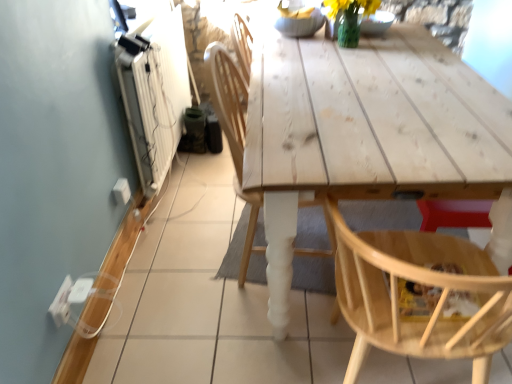
The height and width of the screenshot is (384, 512). Find the location of `natural wood chair at lower right, placed as the 1th chair when sorted from right to left`. natural wood chair at lower right, placed as the 1th chair when sorted from right to left is located at coordinates (418, 282).

What is the approximate width of white plastic electric outlet at lower left, which is counted as the 1th electric outlet, starting from the left?

0.41 inches.

You are a GUI agent. You are given a task and a screenshot of the screen. Output one action in this format:
    pyautogui.click(x=<x>, y=<y>)
    Task: Click on the wooden chair at center, acting as the 1th chair starting from the left
    This screenshot has width=512, height=384.
    Given the screenshot: What is the action you would take?
    pyautogui.click(x=233, y=133)

Locate an element on the screen. Image resolution: width=512 pixels, height=384 pixels. white plastic electric outlet at lower left, arranged as the 2th electric outlet when viewed from the front is located at coordinates (121, 191).

From a real-world perspective, is wooden chair at center, the 2th chair when ordered from right to left, located beneath white plastic electric outlet at lower left, the 2th electric outlet viewed from the right?

No, from a real-world perspective, wooden chair at center, the 2th chair when ordered from right to left, is not beneath white plastic electric outlet at lower left, the 2th electric outlet viewed from the right.

Could you tell me if wooden chair at center, acting as the 1th chair starting from the left, is turned towards white plastic electric outlet at lower left, the second electric outlet positioned from the back?

No, wooden chair at center, acting as the 1th chair starting from the left, is not turned towards white plastic electric outlet at lower left, the second electric outlet positioned from the back.

Can you confirm if wooden chair at center, the 2th chair when ordered from right to left, is positioned to the left of white plastic electric outlet at lower left, the second electric outlet positioned from the back?

Incorrect, wooden chair at center, the 2th chair when ordered from right to left, is not on the left side of white plastic electric outlet at lower left, the second electric outlet positioned from the back.

From the image's perspective, would you say wooden chair at center, acting as the 1th chair starting from the left, is shown under white plastic electric outlet at lower left, the second electric outlet positioned from the back?

No, from the image's perspective, wooden chair at center, acting as the 1th chair starting from the left, is not below white plastic electric outlet at lower left, the second electric outlet positioned from the back.

Is wooden chair at center, the 2th chair when ordered from right to left, inside or outside of white plastic electric outlet at lower left, the first electric outlet when ordered from top to bottom?

wooden chair at center, the 2th chair when ordered from right to left, exists outside the volume of white plastic electric outlet at lower left, the first electric outlet when ordered from top to bottom.

From the image's perspective, is wooden chair at center, acting as the 1th chair starting from the left, positioned above or below white plastic electric outlet at lower left, which is the second electric outlet in left-to-right order?

From the image's perspective, wooden chair at center, acting as the 1th chair starting from the left, appears above white plastic electric outlet at lower left, which is the second electric outlet in left-to-right order.

From the white plastic electric outlet at lower left, placed as the second electric outlet when sorted from bottom to top, count 1st chairs forward and point to it. Please provide its 2D coordinates.

[(233, 133)]

Can you confirm if white plastic electric outlet at lower left, acting as the 2th electric outlet starting from the top, is positioned to the right of white plastic electric outlet at lower left, the first electric outlet when ordered from top to bottom?

In fact, white plastic electric outlet at lower left, acting as the 2th electric outlet starting from the top, is to the left of white plastic electric outlet at lower left, the first electric outlet when ordered from top to bottom.

Does point (65, 323) appear closer or farther from the camera than point (117, 193)?

Point (65, 323) is positioned closer to the camera compared to point (117, 193).

From a real-world perspective, is white plastic electric outlet at lower left, placed as the first electric outlet when sorted from bottom to top, above or below white plastic electric outlet at lower left, acting as the 1th electric outlet starting from the back?

white plastic electric outlet at lower left, placed as the first electric outlet when sorted from bottom to top, is situated higher than white plastic electric outlet at lower left, acting as the 1th electric outlet starting from the back, in the real world.

Which point is more distant from viewer, (398, 314) or (63, 301)?

The point (63, 301) is behind.

Can you confirm if natural wood chair at lower right, the second chair positioned from the left, is wider than white plastic electric outlet at lower left, the 2th electric outlet viewed from the right?

Indeed, natural wood chair at lower right, the second chair positioned from the left, has a greater width compared to white plastic electric outlet at lower left, the 2th electric outlet viewed from the right.

Could you measure the distance between natural wood chair at lower right, placed as the 1th chair when sorted from right to left, and white plastic electric outlet at lower left, which is counted as the 1th electric outlet, starting from the left?

natural wood chair at lower right, placed as the 1th chair when sorted from right to left, and white plastic electric outlet at lower left, which is counted as the 1th electric outlet, starting from the left, are 3.50 feet apart.

Choose the correct answer: Is white plastic electric outlet at lower left, acting as the 2th electric outlet starting from the top, inside wooden chair at center, the 2th chair when ordered from right to left, or outside it?

white plastic electric outlet at lower left, acting as the 2th electric outlet starting from the top, is outside wooden chair at center, the 2th chair when ordered from right to left.

Is white plastic electric outlet at lower left, placed as the first electric outlet when sorted from bottom to top, positioned behind wooden chair at center, the 2th chair when ordered from right to left?

Yes, white plastic electric outlet at lower left, placed as the first electric outlet when sorted from bottom to top, is further from the viewer.

Locate an element on the screen. This screenshot has width=512, height=384. chair that is the 2nd object located above the white plastic electric outlet at lower left, the second electric outlet positioned from the back (from the image's perspective) is located at coordinates (233, 133).

From a real-world perspective, which object rests below the other?

white plastic electric outlet at lower left, the 2th electric outlet viewed from the right, is physically lower.

Is white plastic electric outlet at lower left, which is the second electric outlet in left-to-right order, shorter than wooden chair at center, the 2th chair when ordered from right to left?

Yes.

How much distance is there between white plastic electric outlet at lower left, which is the second electric outlet in left-to-right order, and wooden chair at center, acting as the 1th chair starting from the left?

white plastic electric outlet at lower left, which is the second electric outlet in left-to-right order, is 29.37 inches away from wooden chair at center, acting as the 1th chair starting from the left.

Which is closer to the camera, (122,190) or (237,185)?

The point (122,190) is in front.

In the scene shown: From the image's perspective, would you say white plastic electric outlet at lower left, acting as the 1th electric outlet starting from the back, is positioned over wooden chair at center, the 2th chair when ordered from right to left?

No, from the image's perspective, white plastic electric outlet at lower left, acting as the 1th electric outlet starting from the back, is not on top of wooden chair at center, the 2th chair when ordered from right to left.

Is white plastic electric outlet at lower left, which is the second electric outlet in left-to-right order, oriented away from white plastic electric outlet at lower left, the second electric outlet positioned from the back?

white plastic electric outlet at lower left, which is the second electric outlet in left-to-right order, does not have its back to white plastic electric outlet at lower left, the second electric outlet positioned from the back.

Is white plastic electric outlet at lower left, the first electric outlet when ordered from top to bottom, outside of white plastic electric outlet at lower left, acting as the 2th electric outlet starting from the top?

Yes.

Is white plastic electric outlet at lower left, the first electric outlet when ordered from top to bottom, far away from white plastic electric outlet at lower left, which is counted as the 1th electric outlet, starting from the left?

white plastic electric outlet at lower left, the first electric outlet when ordered from top to bottom, is near white plastic electric outlet at lower left, which is counted as the 1th electric outlet, starting from the left, not far away.

Is white plastic electric outlet at lower left, arranged as the first electric outlet when viewed from the right, positioned before white plastic electric outlet at lower left, which is counted as the 1th electric outlet, starting from the left?

No.

In order to click on electric outlet that is the 1st one below the wooden chair at center, the 2th chair when ordered from right to left (from a real-world perspective) in this screenshot , I will do `click(61, 303)`.

Find the location of a particular element. The height and width of the screenshot is (384, 512). the 1st chair to the right when counting from the white plastic electric outlet at lower left, the first electric outlet when ordered from top to bottom is located at coordinates (233, 133).

Looking at the image, which one is located further to white plastic electric outlet at lower left, arranged as the 2th electric outlet when viewed from the front, white plastic electric outlet at lower left, placed as the first electric outlet when sorted from bottom to top, or wooden chair at center, acting as the 1th chair starting from the left?

The object further to white plastic electric outlet at lower left, arranged as the 2th electric outlet when viewed from the front, is wooden chair at center, acting as the 1th chair starting from the left.

From the image, which object appears to be farther from wooden chair at center, acting as the 1th chair starting from the left, natural wood chair at lower right, placed as the 1th chair when sorted from right to left, or white plastic electric outlet at lower left, which is the second electric outlet in left-to-right order?

Based on the image, white plastic electric outlet at lower left, which is the second electric outlet in left-to-right order, appears to be further to wooden chair at center, acting as the 1th chair starting from the left.

Considering their positions, is wooden chair at center, the 2th chair when ordered from right to left, positioned closer to white plastic electric outlet at lower left, acting as the 1th electric outlet starting from the back, than white plastic electric outlet at lower left, the 2th electric outlet viewed from the right?

white plastic electric outlet at lower left, the 2th electric outlet viewed from the right, is closer to white plastic electric outlet at lower left, acting as the 1th electric outlet starting from the back.

From the image, which object appears to be nearer to natural wood chair at lower right, placed as the 1th chair when sorted from right to left, wooden chair at center, acting as the 1th chair starting from the left, or white plastic electric outlet at lower left, which is counted as the 1th electric outlet, starting from the left?

Based on the image, wooden chair at center, acting as the 1th chair starting from the left, appears to be nearer to natural wood chair at lower right, placed as the 1th chair when sorted from right to left.

Considering their positions, is natural wood chair at lower right, the second chair positioned from the left, positioned further to white plastic electric outlet at lower left, which is the second electric outlet in left-to-right order, than wooden chair at center, the 2th chair when ordered from right to left?

natural wood chair at lower right, the second chair positioned from the left.

Which object lies further to the anchor point natural wood chair at lower right, placed as the 1th chair when sorted from right to left, white plastic electric outlet at lower left, which is counted as the 1th electric outlet, starting from the left, or wooden chair at center, acting as the 1th chair starting from the left?

Based on the image, white plastic electric outlet at lower left, which is counted as the 1th electric outlet, starting from the left, appears to be further to natural wood chair at lower right, placed as the 1th chair when sorted from right to left.

Estimate the real-world distances between objects in this image. Which object is closer to wooden chair at center, the 2th chair when ordered from right to left, white plastic electric outlet at lower left, arranged as the 2th electric outlet when viewed from the front, or natural wood chair at lower right, placed as the 1th chair when sorted from right to left?

Among the two, natural wood chair at lower right, placed as the 1th chair when sorted from right to left, is located nearer to wooden chair at center, the 2th chair when ordered from right to left.

Looking at the image, which one is located further to white plastic electric outlet at lower left, placed as the first electric outlet when sorted from bottom to top, natural wood chair at lower right, the second chair positioned from the left, or white plastic electric outlet at lower left, placed as the second electric outlet when sorted from bottom to top?

natural wood chair at lower right, the second chair positioned from the left, is positioned further to the anchor white plastic electric outlet at lower left, placed as the first electric outlet when sorted from bottom to top.

At what (x,y) coordinates should I click in order to perform the action: click on chair located between white plastic electric outlet at lower left, the 2th electric outlet viewed from the right, and natural wood chair at lower right, placed as the 1th chair when sorted from right to left, in the left-right direction. Please return your answer as a coordinate pair (x, y). The height and width of the screenshot is (384, 512). Looking at the image, I should click on (233, 133).

Where is `chair located between natural wood chair at lower right, the second chair positioned from the left, and white plastic electric outlet at lower left, the first electric outlet when ordered from top to bottom, in the depth direction`? This screenshot has height=384, width=512. chair located between natural wood chair at lower right, the second chair positioned from the left, and white plastic electric outlet at lower left, the first electric outlet when ordered from top to bottom, in the depth direction is located at coordinates (233, 133).

Find the location of `electric outlet between white plastic electric outlet at lower left, the 2th electric outlet viewed from the right, and wooden chair at center, acting as the 1th chair starting from the left, in the horizontal direction`. electric outlet between white plastic electric outlet at lower left, the 2th electric outlet viewed from the right, and wooden chair at center, acting as the 1th chair starting from the left, in the horizontal direction is located at coordinates (121, 191).

Locate an element on the screen. This screenshot has width=512, height=384. electric outlet located between white plastic electric outlet at lower left, the 2th electric outlet viewed from the right, and natural wood chair at lower right, placed as the 1th chair when sorted from right to left, in the left-right direction is located at coordinates (121, 191).